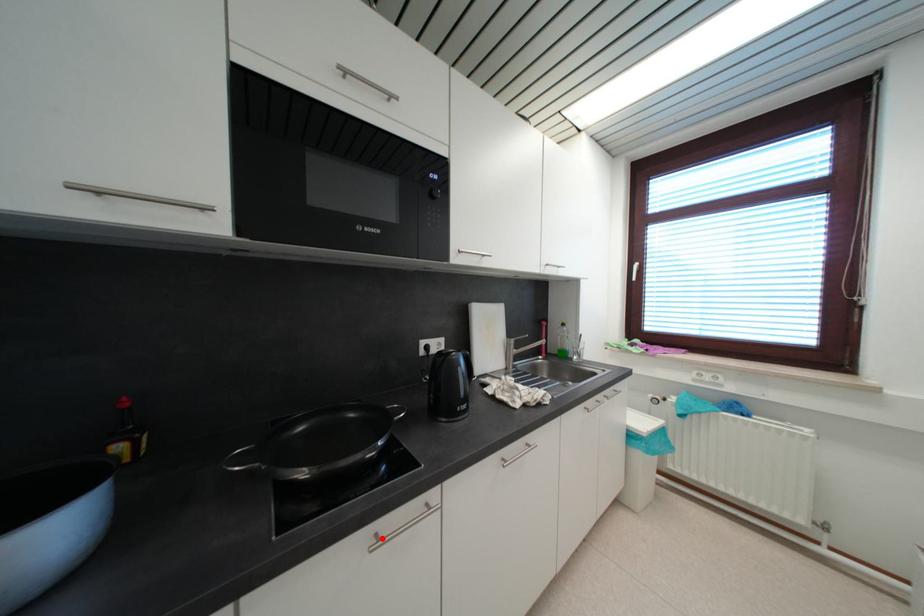
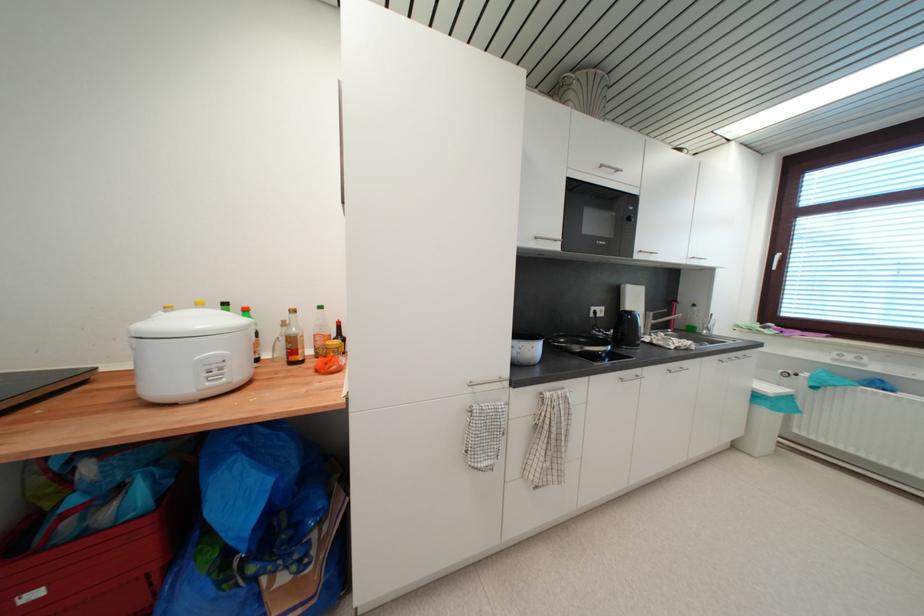
Locate, in the second image, the point that corresponds to the highlighted location in the first image.

(626, 381)